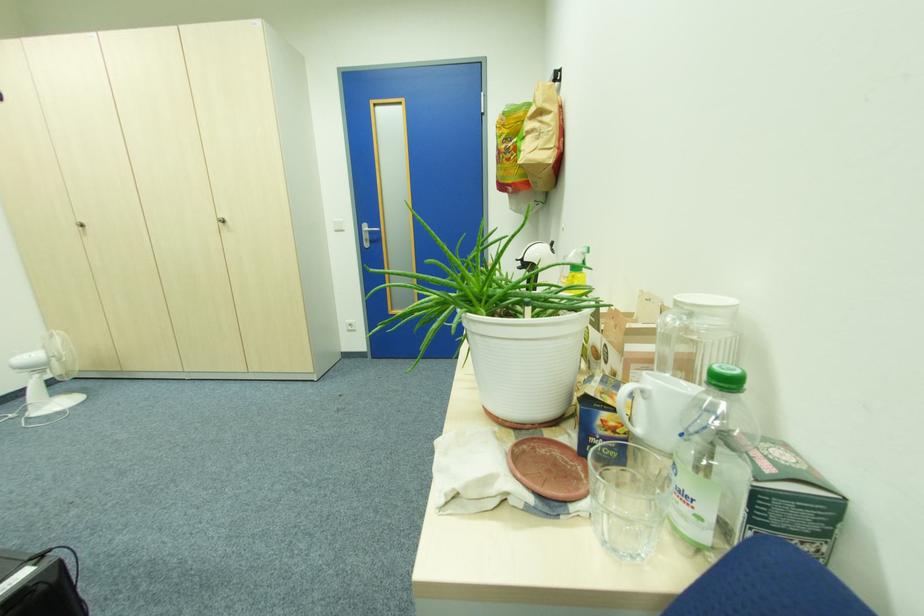
What do you see at coordinates (704, 302) in the screenshot? I see `the white jar lid` at bounding box center [704, 302].